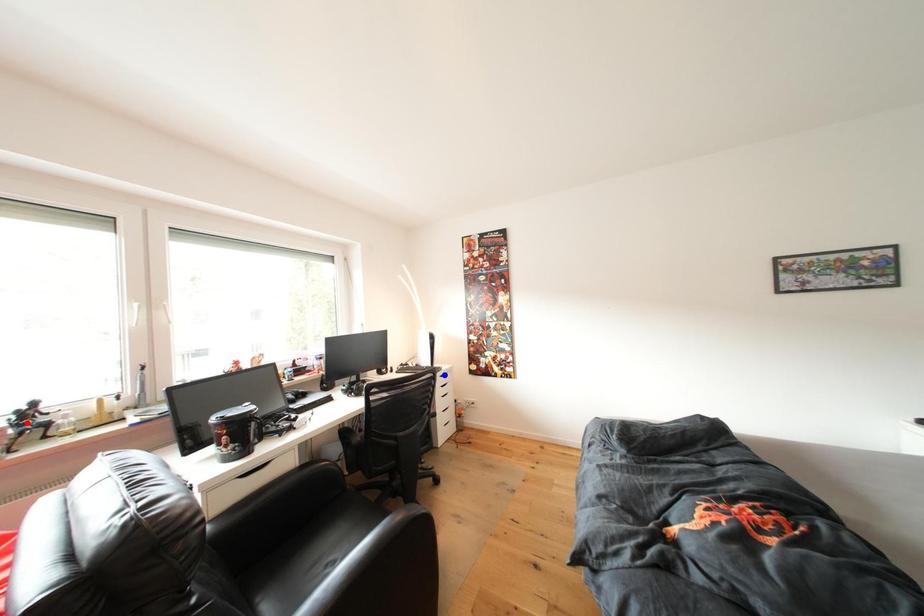
Question: Which of the two points in the image is closer to the camera?

Choices:
 (A) Blue point is closer.
 (B) Red point is closer.

Answer: (B)